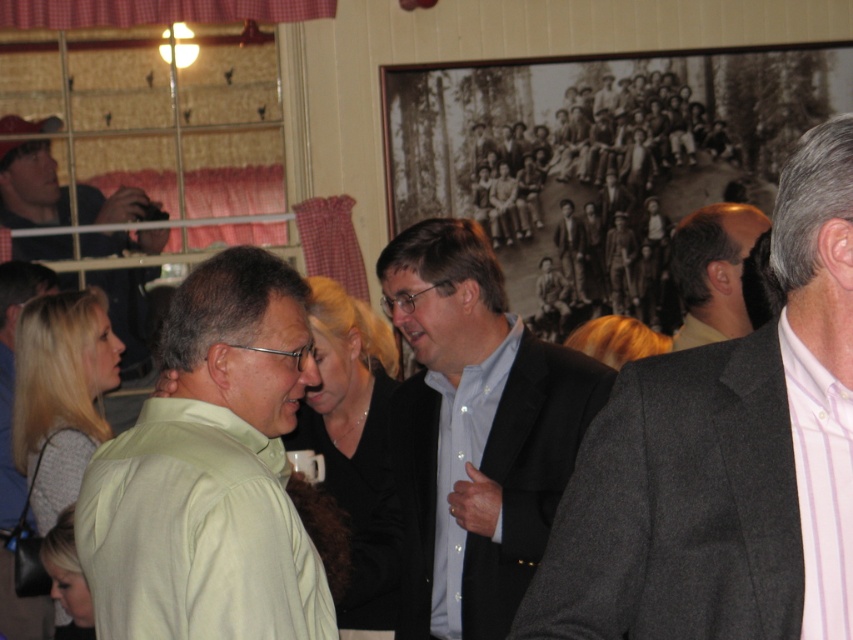
Between gray wool suit at right and brown hair at center, which one has more height?

gray wool suit at right is taller.

Which is more to the right, gray wool suit at right or brown hair at center?

From the viewer's perspective, brown hair at center appears more on the right side.

Locate an element on the screen. gray wool suit at right is located at coordinates point(724,460).

The height and width of the screenshot is (640, 853). Describe the element at coordinates (210, 474) in the screenshot. I see `green matte shirt at center` at that location.

Can you confirm if green matte shirt at center is bigger than matte black suit at center?

No, green matte shirt at center is not bigger than matte black suit at center.

Between point (262, 474) and point (479, 227), which one is positioned behind?

The point (479, 227) is more distant.

Image resolution: width=853 pixels, height=640 pixels. Find the location of `green matte shirt at center`. green matte shirt at center is located at coordinates (210, 474).

Is gray wool suit at right smaller than matte black suit at center?

Indeed, gray wool suit at right has a smaller size compared to matte black suit at center.

Between point (550, 625) and point (448, 630), which one is positioned in front?

Positioned in front is point (550, 625).

Where is `gray wool suit at right`? The width and height of the screenshot is (853, 640). gray wool suit at right is located at coordinates (724, 460).